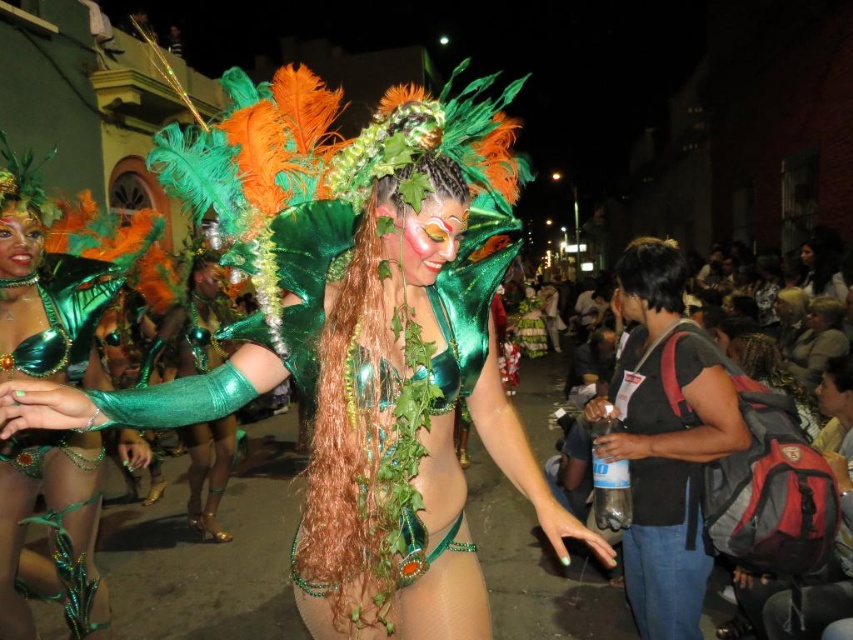
Question: Which object is the farthest from the black matte backpack at right?

Choices:
 (A) green velvet bikini at center
 (B) green sequined bikini top at center

Answer: (B)

Question: Does green sequined bikini top at center have a larger size compared to black matte backpack at right?

Choices:
 (A) yes
 (B) no

Answer: (A)

Question: Estimate the real-world distances between objects in this image. Which object is closer to the green sequined bikini top at center?

Choices:
 (A) green velvet bikini at center
 (B) black matte backpack at right

Answer: (A)

Question: Can you confirm if green sequined bikini top at center is positioned below black matte backpack at right?

Choices:
 (A) yes
 (B) no

Answer: (B)

Question: Does green velvet bikini at center have a smaller size compared to green sequined bikini top at center?

Choices:
 (A) yes
 (B) no

Answer: (B)

Question: Which of the following is the closest to the observer?

Choices:
 (A) (227, 138)
 (B) (740, 444)
 (C) (67, 588)

Answer: (A)